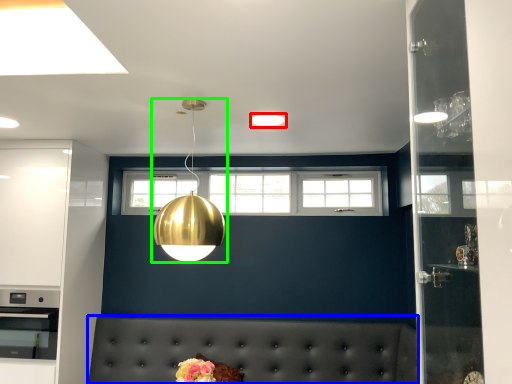
Question: Based on their relative distances, which object is nearer to lighting (highlighted by a red box)? Choose from couch (highlighted by a blue box) and lamp (highlighted by a green box).

Choices:
 (A) couch
 (B) lamp

Answer: (B)